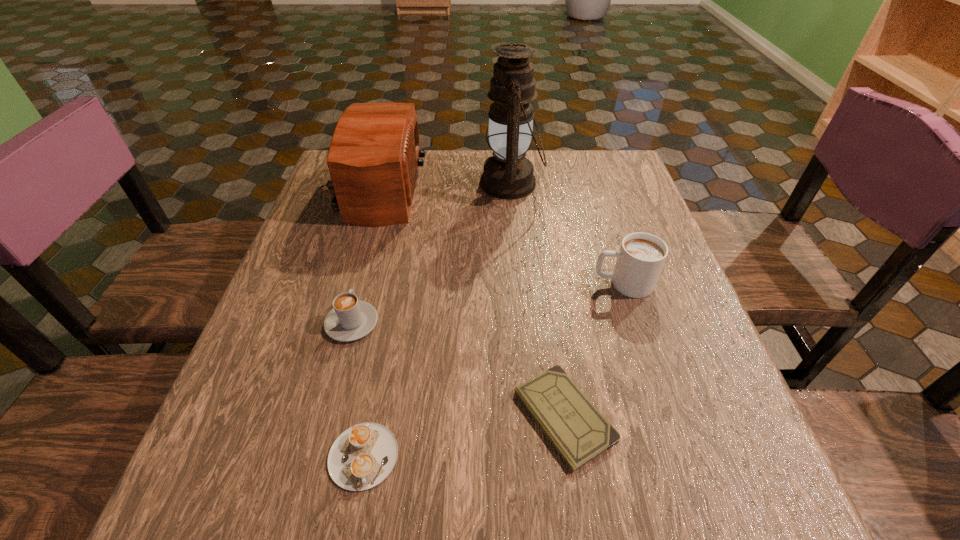
Locate an element on the screen. The image size is (960, 540). blank space located 0.360m on the front-facing side of the fifth shortest object is located at coordinates (559, 189).

This screenshot has width=960, height=540. I want to click on vacant region located on the side with the handle of the rightmost cappuccino, so click(540, 284).

At what (x,y) coordinates should I click in order to perform the action: click on free location located on the side with the handle of the rightmost cappuccino. Please return your answer as a coordinate pair (x, y). The image size is (960, 540). Looking at the image, I should click on (459, 284).

Where is `free spot located on the side with the handle of the rightmost cappuccino`? This screenshot has height=540, width=960. free spot located on the side with the handle of the rightmost cappuccino is located at coordinates (406, 284).

Find the location of `free space located to the right of the second tallest cappuccino`. free space located to the right of the second tallest cappuccino is located at coordinates (386, 195).

At what (x,y) coordinates should I click in order to perform the action: click on vacant space located 0.380m to the right of the second tallest cappuccino. Please return your answer as a coordinate pair (x, y). Looking at the image, I should click on (386, 195).

Locate an element on the screen. Image resolution: width=960 pixels, height=540 pixels. free space located 0.380m to the right of the second tallest cappuccino is located at coordinates (386, 195).

Where is `free space located on the back of the shortest cappuccino`? free space located on the back of the shortest cappuccino is located at coordinates (391, 310).

Where is `vacant region located on the left of the checkbook`? vacant region located on the left of the checkbook is located at coordinates (318, 416).

The image size is (960, 540). Find the location of `oil lamp located at the far edge`. oil lamp located at the far edge is located at coordinates (507, 174).